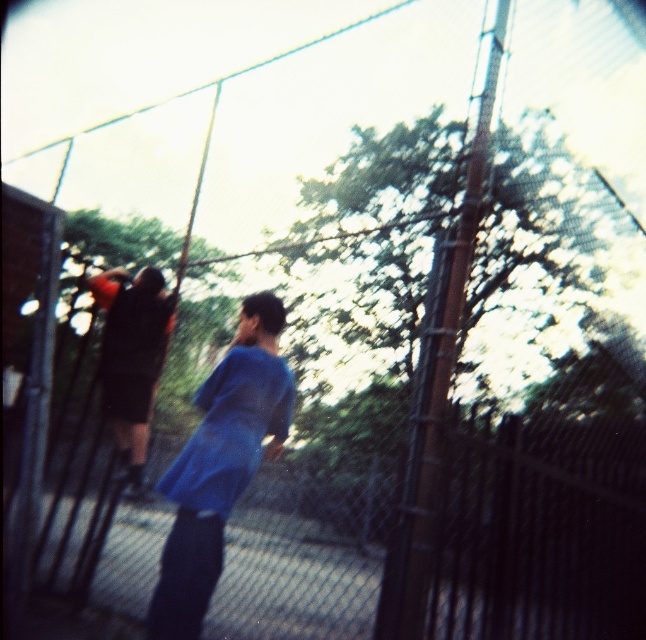
Question: Can you confirm if blue fabric shirt at center is positioned to the left of dark blue shirt at center?

Choices:
 (A) yes
 (B) no

Answer: (B)

Question: Is blue fabric shirt at center below dark blue shirt at center?

Choices:
 (A) yes
 (B) no

Answer: (A)

Question: Which point is farther to the camera?

Choices:
 (A) blue fabric shirt at center
 (B) dark blue shirt at center

Answer: (B)

Question: Is blue fabric shirt at center above dark blue shirt at center?

Choices:
 (A) yes
 (B) no

Answer: (B)

Question: Which point is closer to the camera taking this photo?

Choices:
 (A) (147, 344)
 (B) (205, 496)

Answer: (B)